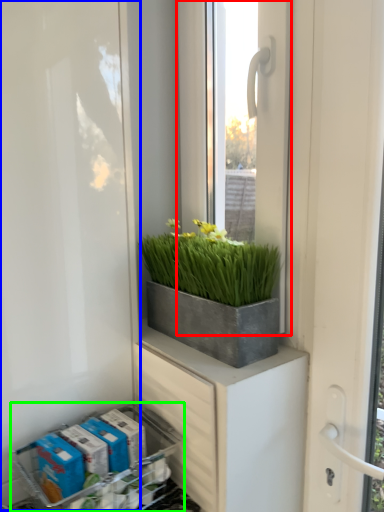
Question: Estimate the real-world distances between objects in this image. Which object is closer to window (highlighted by a red box), screen door (highlighted by a blue box) or flower box (highlighted by a green box)?

Choices:
 (A) screen door
 (B) flower box

Answer: (A)